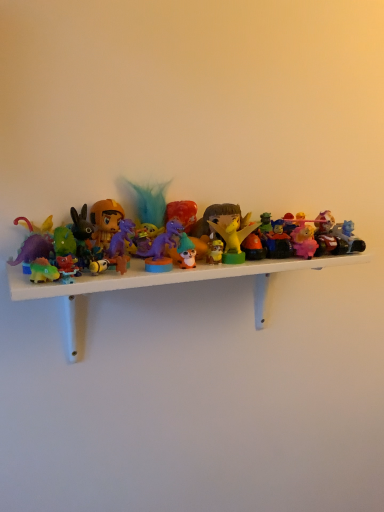
The width and height of the screenshot is (384, 512). Describe the element at coordinates (325, 233) in the screenshot. I see `translucent plastic car at right, which is the first toy in right-to-left order` at that location.

Where is `translucent plastic car at right, the eighth toy positioned from the left`? This screenshot has height=512, width=384. translucent plastic car at right, the eighth toy positioned from the left is located at coordinates (325, 233).

The width and height of the screenshot is (384, 512). Describe the element at coordinates (120, 245) in the screenshot. I see `purple plastic dinosaur at center, the 7th toy viewed from the right` at that location.

You are a GUI agent. You are given a task and a screenshot of the screen. Output one action in this format:
    pyautogui.click(x=<x>, y=<y>)
    Task: Click on the matte yellow dragon at center, the 5th toy from the left
    The image size is (384, 512).
    Given the screenshot: What is the action you would take?
    pyautogui.click(x=233, y=239)

At what (x,y) coordinates should I click in order to perform the action: click on matte orange helmet at left, which ranks as the eighth toy in right-to-left order. Please return your answer as a coordinate pair (x, y). Image resolution: width=384 pixels, height=512 pixels. Looking at the image, I should click on (105, 222).

Where is `purple plastic dinosaur at center, acting as the 3th toy starting from the left`? purple plastic dinosaur at center, acting as the 3th toy starting from the left is located at coordinates (163, 248).

Find the location of a particular element. Image resolution: width=384 pixels, height=512 pixels. rubber car at center, marked as the 3th toy in a right-to-left arrangement is located at coordinates (278, 241).

What do you see at coordinates (186, 252) in the screenshot? The image size is (384, 512). I see `matte orange figurine at center, which ranks as the fifth toy in right-to-left order` at bounding box center [186, 252].

What are the coordinates of `translucent plastic car at right, the eighth toy positioned from the left` in the screenshot? It's located at (325, 233).

Can we say rubber car at center, which is the 6th toy in left-to-right order, lies outside translucent plastic car at right, which is the first toy in right-to-left order?

Yes, rubber car at center, which is the 6th toy in left-to-right order, is not within translucent plastic car at right, which is the first toy in right-to-left order.

Which of these two, rubber car at center, which is the 6th toy in left-to-right order, or translucent plastic car at right, the eighth toy positioned from the left, is smaller?

With smaller size is translucent plastic car at right, the eighth toy positioned from the left.

Considering the positions of objects rubber car at center, marked as the 3th toy in a right-to-left arrangement, and translucent plastic car at right, the eighth toy positioned from the left, in the image provided, who is behind, rubber car at center, marked as the 3th toy in a right-to-left arrangement, or translucent plastic car at right, the eighth toy positioned from the left,?

translucent plastic car at right, the eighth toy positioned from the left, is further away from the camera.

Measure the distance between rubber car at center, marked as the 3th toy in a right-to-left arrangement, and translucent plastic car at right, which is the first toy in right-to-left order.

They are 2.73 inches apart.

Considering the relative sizes of matte orange helmet at left, the 1th toy from the left, and purple plastic dinosaur at center, acting as the 3th toy starting from the left, in the image provided, is matte orange helmet at left, the 1th toy from the left, smaller than purple plastic dinosaur at center, acting as the 3th toy starting from the left,?

No, matte orange helmet at left, the 1th toy from the left, is not smaller than purple plastic dinosaur at center, acting as the 3th toy starting from the left.

From a real-world perspective, is matte orange helmet at left, which ranks as the eighth toy in right-to-left order, under purple plastic dinosaur at center, acting as the 3th toy starting from the left?

Incorrect, from a real-world perspective, matte orange helmet at left, which ranks as the eighth toy in right-to-left order, is higher than purple plastic dinosaur at center, acting as the 3th toy starting from the left.

The image size is (384, 512). I want to click on the 2nd toy below the matte orange helmet at left, the 1th toy from the left (from a real-world perspective), so click(163, 248).

Considering the sizes of objects pink matte figurine at center-right, arranged as the second toy when viewed from the right, and translucent plastic car at right, which is the first toy in right-to-left order, in the image provided, who is wider, pink matte figurine at center-right, arranged as the second toy when viewed from the right, or translucent plastic car at right, which is the first toy in right-to-left order,?

With larger width is pink matte figurine at center-right, arranged as the second toy when viewed from the right.

Looking at this image, could you tell me if pink matte figurine at center-right, the 7th toy when ordered from left to right, is turned towards translucent plastic car at right, the eighth toy positioned from the left?

No, pink matte figurine at center-right, the 7th toy when ordered from left to right, is not aimed at translucent plastic car at right, the eighth toy positioned from the left.

Is pink matte figurine at center-right, the 7th toy when ordered from left to right, to the left of translucent plastic car at right, the eighth toy positioned from the left, from the viewer's perspective?

Yes, pink matte figurine at center-right, the 7th toy when ordered from left to right, is to the left of translucent plastic car at right, the eighth toy positioned from the left.

Can you see pink matte figurine at center-right, arranged as the second toy when viewed from the right, touching translucent plastic car at right, which is the first toy in right-to-left order?

Yes, pink matte figurine at center-right, arranged as the second toy when viewed from the right, is right next to translucent plastic car at right, which is the first toy in right-to-left order, and making contact.

Considering the relative positions of matte orange helmet at left, which ranks as the eighth toy in right-to-left order, and translucent plastic car at right, which is the first toy in right-to-left order, in the image provided, is matte orange helmet at left, which ranks as the eighth toy in right-to-left order, to the left of translucent plastic car at right, which is the first toy in right-to-left order, from the viewer's perspective?

Correct, you'll find matte orange helmet at left, which ranks as the eighth toy in right-to-left order, to the left of translucent plastic car at right, which is the first toy in right-to-left order.

Which object is further away from the camera, matte orange helmet at left, which ranks as the eighth toy in right-to-left order, or translucent plastic car at right, which is the first toy in right-to-left order?

translucent plastic car at right, which is the first toy in right-to-left order, is more distant.

Does matte orange helmet at left, which ranks as the eighth toy in right-to-left order, have a greater height compared to translucent plastic car at right, which is the first toy in right-to-left order?

Yes, matte orange helmet at left, which ranks as the eighth toy in right-to-left order, is taller than translucent plastic car at right, which is the first toy in right-to-left order.

From the image's perspective, which one is positioned higher, matte orange helmet at left, the 1th toy from the left, or translucent plastic car at right, the eighth toy positioned from the left?

From the image's view, matte orange helmet at left, the 1th toy from the left, is above.

In the scene shown: Considering the relative positions of plastic toys at center and rubber car at center, which is the 6th toy in left-to-right order, in the image provided, is plastic toys at center to the left of rubber car at center, which is the 6th toy in left-to-right order, from the viewer's perspective?

Yes.

Identify the location of the 6th toy behind the plastic toys at center. (278, 241).

Is plastic toys at center not inside rubber car at center, marked as the 3th toy in a right-to-left arrangement?

Yes, plastic toys at center is outside of rubber car at center, marked as the 3th toy in a right-to-left arrangement.

Is plastic toys at center closer to camera compared to translucent plastic car at right, the eighth toy positioned from the left?

That is True.

Which point is more forward, (132, 278) or (326, 239)?

The point (132, 278) is in front.

Is plastic toys at center facing away from translucent plastic car at right, which is the first toy in right-to-left order?

No, translucent plastic car at right, which is the first toy in right-to-left order, is not at the back of plastic toys at center.

From the image's perspective, between translucent plastic car at right, which is the first toy in right-to-left order, and plastic toys at center, which one is located above?

translucent plastic car at right, which is the first toy in right-to-left order, from the image's perspective.

Is translucent plastic car at right, the eighth toy positioned from the left, next to plastic toys at center?

They are not placed beside each other.

The image size is (384, 512). I want to click on shelf below the translucent plastic car at right, the eighth toy positioned from the left (from a real-world perspective), so click(165, 283).

Does translucent plastic car at right, which is the first toy in right-to-left order, come behind plastic toys at center?

Yes, the depth of translucent plastic car at right, which is the first toy in right-to-left order, is greater than that of plastic toys at center.

The image size is (384, 512). I want to click on toy that is the 2nd object directly below the rubber car at center, marked as the 3th toy in a right-to-left arrangement (from a real-world perspective), so click(x=325, y=233).

The image size is (384, 512). Identify the location of the 2nd toy directly above the purple plastic dinosaur at center, which appears as the sixth toy when viewed from the right (from a real-world perspective). (105, 222).

Consider the image. Based on their spatial positions, is matte orange figurine at center, which ranks as the fifth toy in right-to-left order, or matte yellow dragon at center, the 5th toy from the left, further from translucent plastic car at right, which is the first toy in right-to-left order?

Among the two, matte orange figurine at center, which ranks as the fifth toy in right-to-left order, is located further to translucent plastic car at right, which is the first toy in right-to-left order.

When comparing their distances from plastic toys at center, does translucent plastic car at right, which is the first toy in right-to-left order, or matte orange figurine at center, which ranks as the fifth toy in right-to-left order, seem further?

translucent plastic car at right, which is the first toy in right-to-left order, is further to plastic toys at center.

When comparing their distances from rubber car at center, marked as the 3th toy in a right-to-left arrangement, does plastic toys at center or matte orange helmet at left, the 1th toy from the left, seem closer?

plastic toys at center is closer to rubber car at center, marked as the 3th toy in a right-to-left arrangement.

Estimate the real-world distances between objects in this image. Which object is closer to purple plastic dinosaur at center, acting as the 3th toy starting from the left, pink matte figurine at center-right, the 7th toy when ordered from left to right, or matte orange figurine at center, which ranks as the 4th toy in left-to-right order?

matte orange figurine at center, which ranks as the 4th toy in left-to-right order, is closer to purple plastic dinosaur at center, acting as the 3th toy starting from the left.

Based on their spatial positions, is rubber car at center, marked as the 3th toy in a right-to-left arrangement, or translucent plastic car at right, which is the first toy in right-to-left order, closer to matte orange helmet at left, the 1th toy from the left?

rubber car at center, marked as the 3th toy in a right-to-left arrangement, is closer to matte orange helmet at left, the 1th toy from the left.

Looking at the image, which one is located closer to matte yellow dragon at center, the 5th toy from the left, matte orange helmet at left, which ranks as the eighth toy in right-to-left order, or purple plastic dinosaur at center, which appears as the sixth toy when viewed from the right?

The object closer to matte yellow dragon at center, the 5th toy from the left, is purple plastic dinosaur at center, which appears as the sixth toy when viewed from the right.

Looking at the image, which one is located closer to purple plastic dinosaur at center, acting as the 3th toy starting from the left, matte yellow dragon at center, positioned as the 4th toy in right-to-left order, or plastic toys at center?

matte yellow dragon at center, positioned as the 4th toy in right-to-left order, is closer to purple plastic dinosaur at center, acting as the 3th toy starting from the left.

Considering their positions, is matte orange helmet at left, which ranks as the eighth toy in right-to-left order, positioned further to rubber car at center, which is the 6th toy in left-to-right order, than plastic toys at center?

matte orange helmet at left, which ranks as the eighth toy in right-to-left order, lies further to rubber car at center, which is the 6th toy in left-to-right order, than the other object.

This screenshot has height=512, width=384. I want to click on shelf between matte orange helmet at left, the 1th toy from the left, and matte yellow dragon at center, the 5th toy from the left, in the horizontal direction, so click(x=165, y=283).

Find the location of a particular element. shelf situated between matte orange helmet at left, the 1th toy from the left, and pink matte figurine at center-right, arranged as the second toy when viewed from the right, from left to right is located at coordinates (165, 283).

This screenshot has height=512, width=384. I want to click on toy that lies between purple plastic dinosaur at center, acting as the 3th toy starting from the left, and plastic toys at center from top to bottom, so click(186, 252).

I want to click on shelf situated between matte orange helmet at left, which ranks as the eighth toy in right-to-left order, and translucent plastic car at right, the eighth toy positioned from the left, from left to right, so click(x=165, y=283).